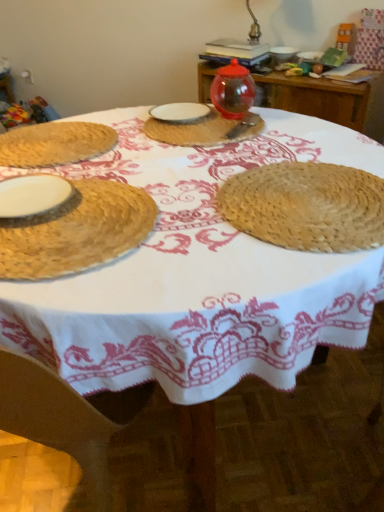
Identify the location of vacant space in front of transparent glass jar at upper center, which is the third tableware from front to back. The image size is (384, 512). (233, 133).